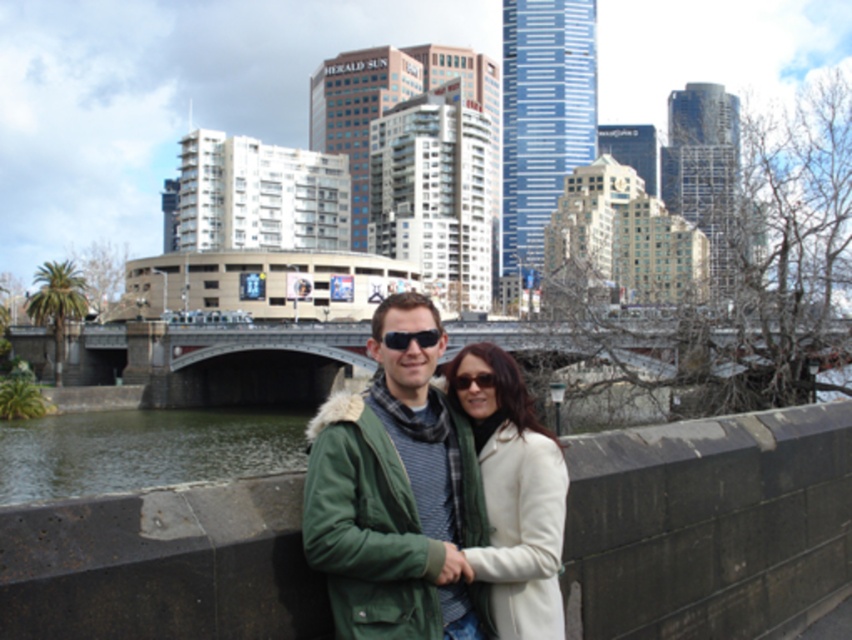
Question: Which object appears farthest from the camera in this image?

Choices:
 (A) concrete ledge at center
 (B) black plastic sunglasses at center
 (C) green fabric coat at center

Answer: (B)

Question: Does green fabric coat at center have a lesser width compared to black plastic sunglasses at center?

Choices:
 (A) no
 (B) yes

Answer: (A)

Question: From the image, what is the correct spatial relationship of green water at lower left in relation to white wool coat at center?

Choices:
 (A) above
 (B) below

Answer: (B)

Question: Does green water at lower left appear on the left side of black plastic sunglasses at center?

Choices:
 (A) yes
 (B) no

Answer: (A)

Question: Which of the following is the closest to the observer?

Choices:
 (A) black plastic sunglasses at center
 (B) white wool coat at center
 (C) concrete ledge at center

Answer: (C)

Question: Which point is closer to the camera?

Choices:
 (A) (49, 451)
 (B) (390, 337)
 (C) (744, 544)

Answer: (B)